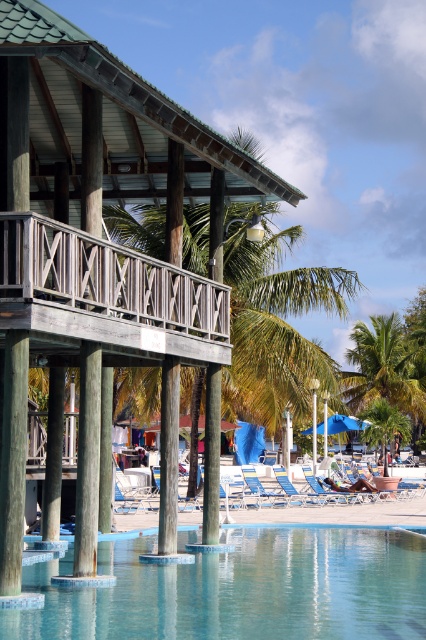
Is blue fabric umbrella at center taller than blue fabric beach chair at center?

Yes, blue fabric umbrella at center is taller than blue fabric beach chair at center.

Which is below, blue fabric umbrella at center or blue fabric beach chair at center?

blue fabric beach chair at center is below.

Is point (331, 428) more distant than point (252, 484)?

Yes.

I want to click on blue fabric umbrella at center, so click(339, 424).

Is point (39, 304) positioned before point (389, 384)?

Yes, it is.

From the picture: Who is taller, wooden at upper center or green leafy palm tree at center-right?

With more height is green leafy palm tree at center-right.

Which is in front, point (204, 353) or point (411, 396)?

Point (204, 353) is more forward.

You are a GUI agent. You are given a task and a screenshot of the screen. Output one action in this format:
    pyautogui.click(x=<x>, y=<y>)
    Task: Click on the wooden at upper center
    This screenshot has height=640, width=426.
    Given the screenshot: What is the action you would take?
    pyautogui.click(x=108, y=292)

Can you confirm if clear blue water at lower center is thinner than smooth wood pillar at center?

No.

Does point (135, 564) come closer to viewer compared to point (163, 380)?

Yes.

Locate an element on the screen. clear blue water at lower center is located at coordinates (241, 589).